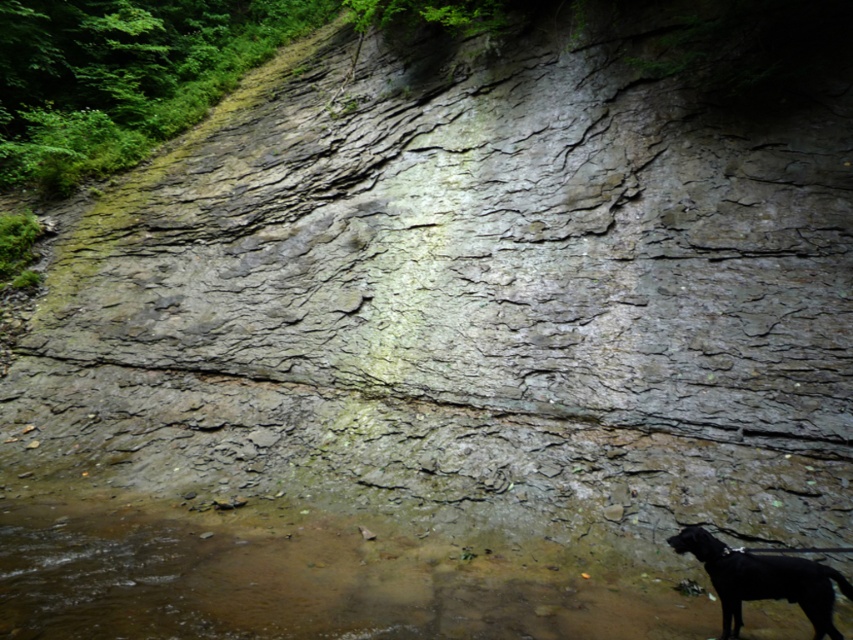
Question: Which object appears farthest from the camera in this image?

Choices:
 (A) brown matte water at lower center
 (B) black matte dog at lower right

Answer: (A)

Question: Is brown matte water at lower center smaller than black matte dog at lower right?

Choices:
 (A) no
 (B) yes

Answer: (A)

Question: Considering the relative positions of brown matte water at lower center and black matte dog at lower right in the image provided, where is brown matte water at lower center located with respect to black matte dog at lower right?

Choices:
 (A) below
 (B) above

Answer: (A)

Question: Which object appears farthest from the camera in this image?

Choices:
 (A) black matte dog at lower right
 (B) brown matte water at lower center

Answer: (B)

Question: Which point is farther from the camera taking this photo?

Choices:
 (A) coord(689,531)
 (B) coord(59,620)

Answer: (A)

Question: Considering the relative positions of brown matte water at lower center and black matte dog at lower right in the image provided, where is brown matte water at lower center located with respect to black matte dog at lower right?

Choices:
 (A) left
 (B) right

Answer: (A)